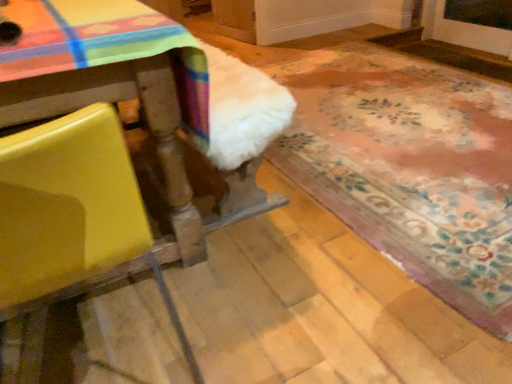
This screenshot has width=512, height=384. In order to click on vacant point to the right of yellow matte chair at left in this screenshot , I will do `click(268, 314)`.